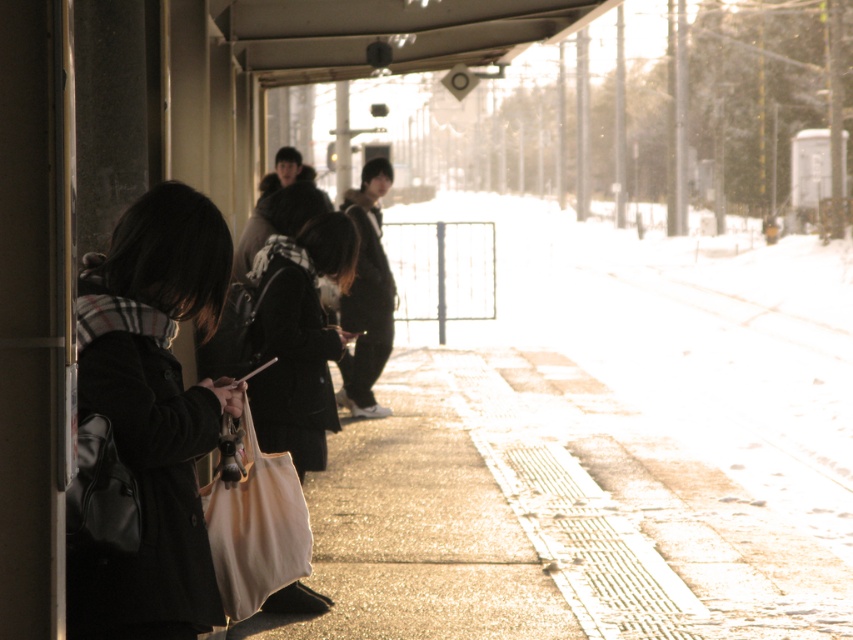
In the scene shown: You are a delivery person who needs to place a beige canvas bag at center on top of the smooth concrete pavement at center. Can you do that?

The smooth concrete pavement at center has a greater height compared to beige canvas bag at center, so yes, the beige canvas bag at center can be placed on top of the smooth concrete pavement at center since it is lower than the pavement.

You are a delivery person who needs to place a package between the black matte coat at center and the beige canvas bag at center on the train station platform. The package requires 6 feet of space. Can you fit it between them?

The black matte coat at center and beige canvas bag at center are 7.38 feet apart from each other, so yes, the package requiring 6 feet of space can fit between them since there is enough space.

You are organizing a luggage rack on the train and need to place the black matte coat at center and the beige canvas bag at center side by side. Given their widths, which item should you place first to ensure they fit properly?

Result: The black matte coat at center is wider than the beige canvas bag at center. Therefore, you should place the black matte coat at center first to accommodate its greater width before placing the beige canvas bag at center.